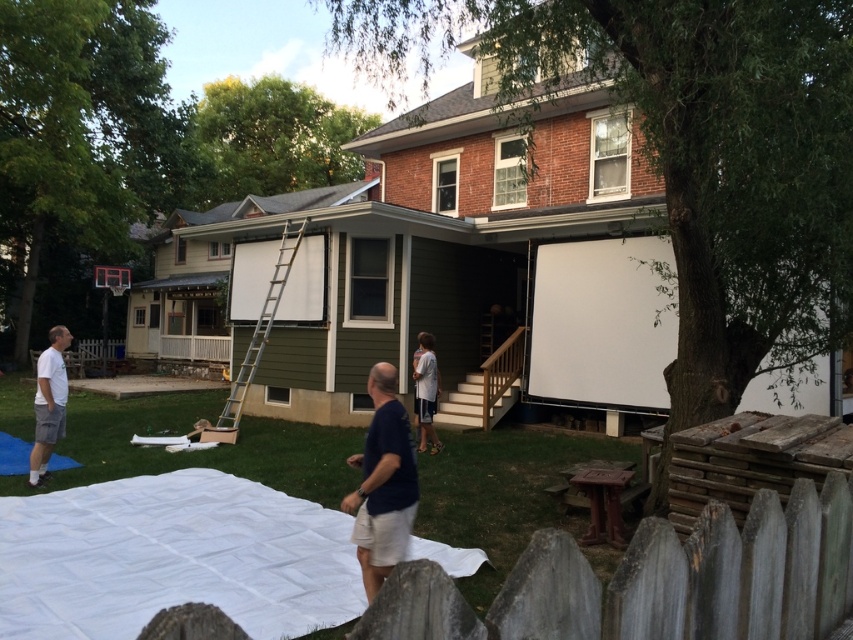
Question: Which object is the closest to the silver metallic ladder at center?

Choices:
 (A) dark blue t-shirt at center
 (B) white matte shirt at lower left
 (C) white cotton shirt at center

Answer: (C)

Question: Which of the following is the farthest from the observer?

Choices:
 (A) (398, 547)
 (B) (250, 369)

Answer: (B)

Question: Is silver metallic ladder at center smaller than white cotton shirt at center?

Choices:
 (A) yes
 (B) no

Answer: (B)

Question: Which of the following is the closest to the observer?

Choices:
 (A) white matte shirt at lower left
 (B) dark blue t-shirt at center

Answer: (B)

Question: Is dark blue t-shirt at center smaller than silver metallic ladder at center?

Choices:
 (A) yes
 (B) no

Answer: (A)

Question: Is white matte shirt at lower left to the right of silver metallic ladder at center from the viewer's perspective?

Choices:
 (A) no
 (B) yes

Answer: (A)